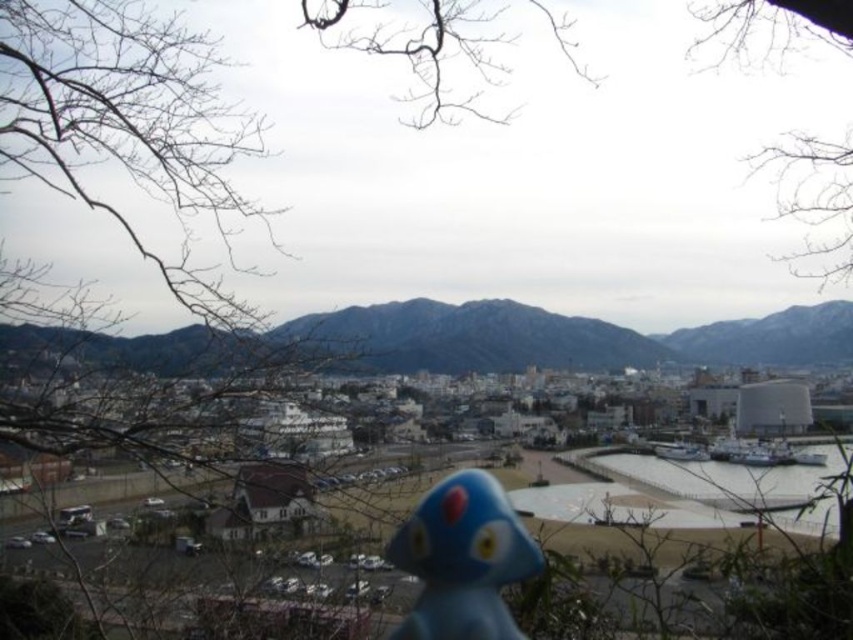
Question: Which point is closer to the camera?

Choices:
 (A) gray rocky mountain at center
 (B) bare branches at upper center
 (C) blue matte figurine at center

Answer: (B)

Question: Which point is farther to the camera?

Choices:
 (A) blue matte figurine at center
 (B) bare branches at upper center
 (C) gray rocky mountain at center

Answer: (C)

Question: Can you confirm if bare branches at upper center is positioned below blue matte figurine at center?

Choices:
 (A) no
 (B) yes

Answer: (A)

Question: Can you confirm if gray rocky mountain at center is wider than bare branches at upper center?

Choices:
 (A) no
 (B) yes

Answer: (B)

Question: Among these objects, which one is farthest from the camera?

Choices:
 (A) blue matte figurine at center
 (B) bare branches at upper center
 (C) gray rocky mountain at center

Answer: (C)

Question: Can you confirm if bare branches at upper center is wider than blue matte figurine at center?

Choices:
 (A) no
 (B) yes

Answer: (B)